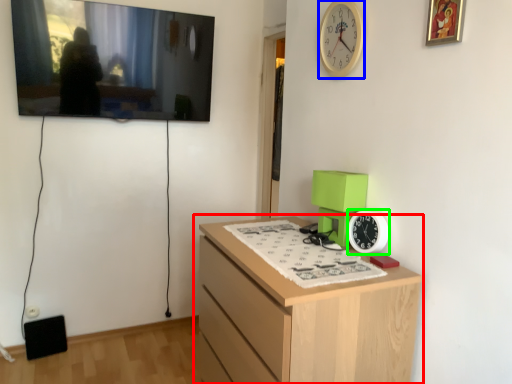
Question: Considering the real-world distances, which object is closest to chest of drawers (highlighted by a red box)? clock (highlighted by a blue box) or clock (highlighted by a green box).

Choices:
 (A) clock
 (B) clock

Answer: (B)